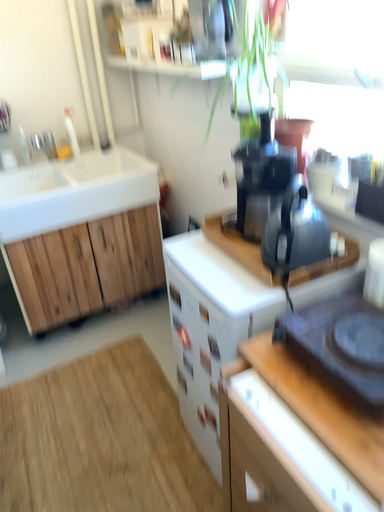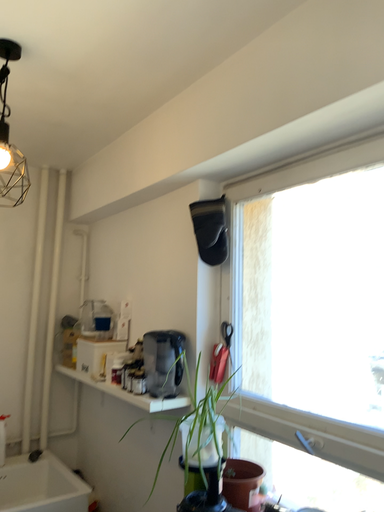
Question: How did the camera likely rotate when shooting the video?

Choices:
 (A) rotated upward
 (B) rotated downward

Answer: (A)